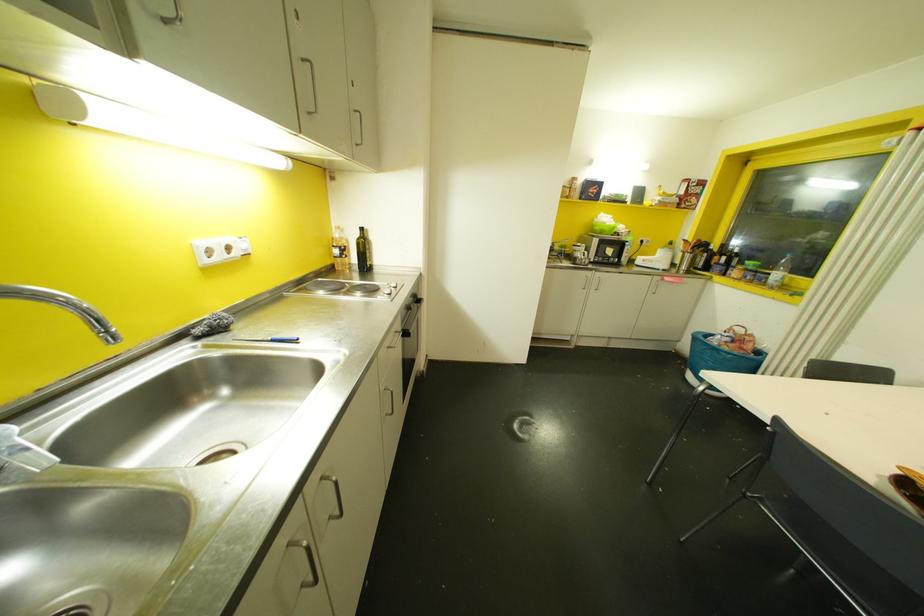
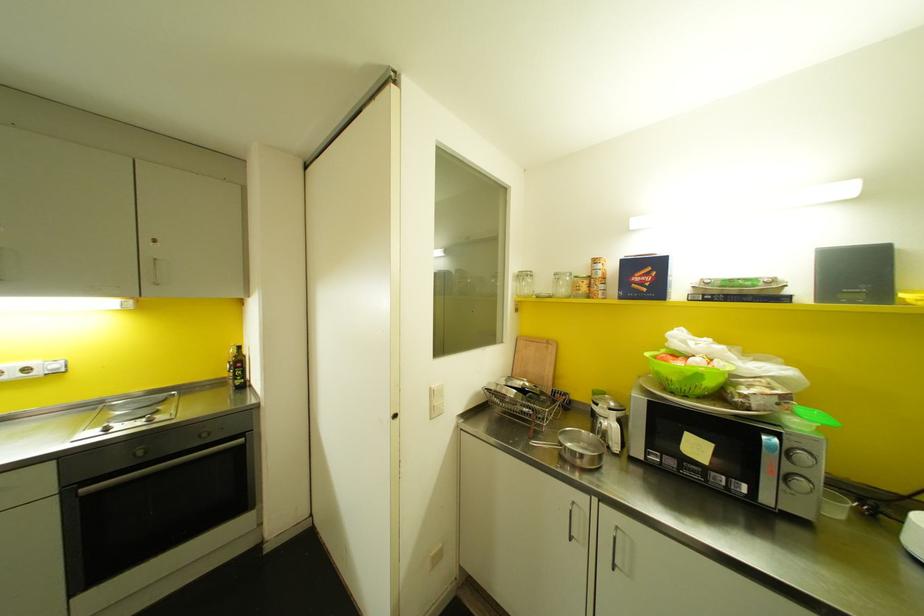
Locate, in the second image, the point that corresponds to the point at 600,184 in the first image.

(659, 264)